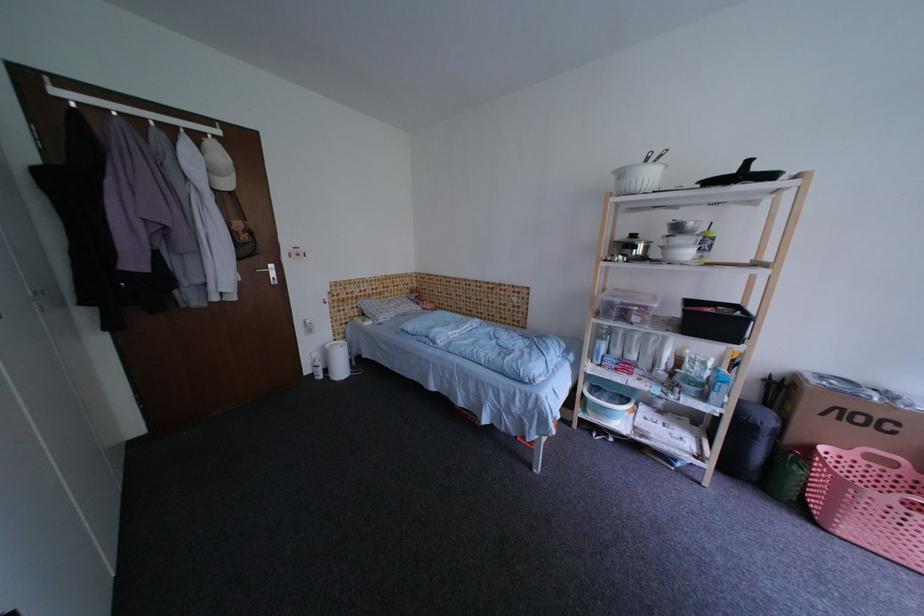
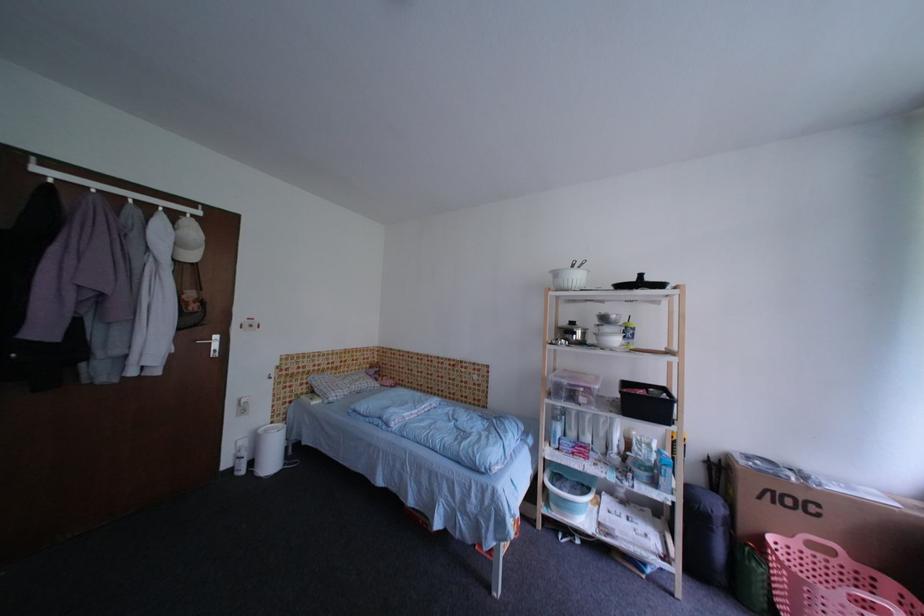
Question: The images are taken continuously from a first-person perspective. In which direction is your viewpoint rotating?

Choices:
 (A) Left
 (B) Right
 (C) Up
 (D) Down

Answer: (C)